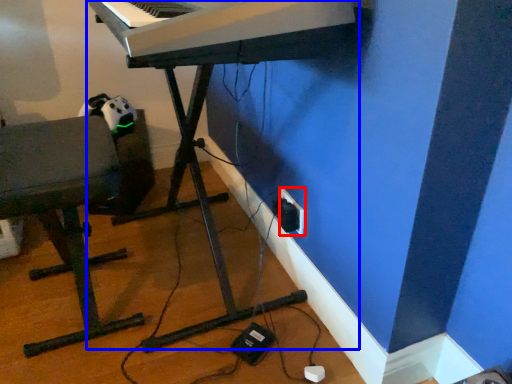
Question: Among these objects, which one is farthest to the camera, electric outlet (highlighted by a red box) or piano (highlighted by a blue box)?

Choices:
 (A) electric outlet
 (B) piano

Answer: (A)